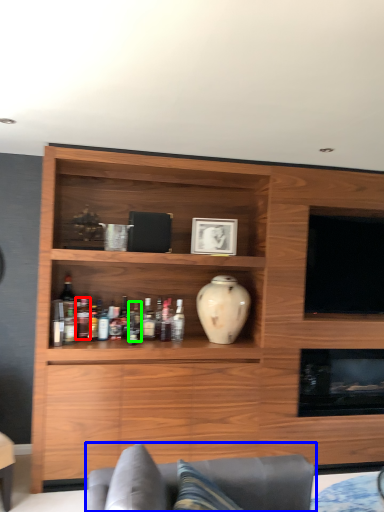
Question: Estimate the real-world distances between objects in this image. Which object is closer to bottle (highlighted by a red box), studio couch (highlighted by a blue box) or bottle (highlighted by a green box)?

Choices:
 (A) studio couch
 (B) bottle

Answer: (B)